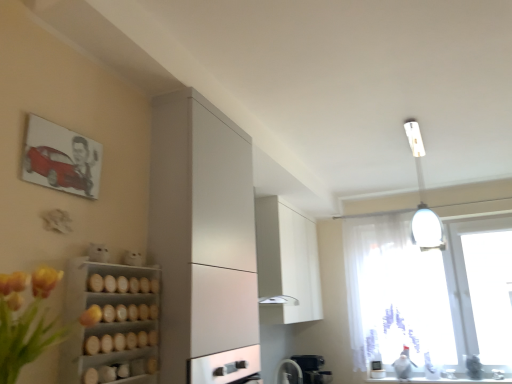
Question: Is white glossy fan at lower center not close to transparent fabric at right?

Choices:
 (A) no
 (B) yes

Answer: (B)

Question: Can you confirm if white glossy fan at lower center is bigger than transparent fabric at right?

Choices:
 (A) no
 (B) yes

Answer: (A)

Question: Can you confirm if white glossy fan at lower center is thinner than transparent fabric at right?

Choices:
 (A) yes
 (B) no

Answer: (B)

Question: Can you confirm if white glossy fan at lower center is taller than transparent fabric at right?

Choices:
 (A) no
 (B) yes

Answer: (A)

Question: Is white glossy fan at lower center in front of transparent fabric at right?

Choices:
 (A) no
 (B) yes

Answer: (B)

Question: In the image, is wooden shelves at lower left on the left side or the right side of white matte cabinet at upper center, positioned as the 2th cabinetry in front-to-back order?

Choices:
 (A) right
 (B) left

Answer: (B)

Question: Is point (62, 357) positioned closer to the camera than point (273, 301)?

Choices:
 (A) farther
 (B) closer

Answer: (B)

Question: Is wooden shelves at lower left taller or shorter than white matte cabinet at upper center, positioned as the 2th cabinetry in front-to-back order?

Choices:
 (A) short
 (B) tall

Answer: (A)

Question: Is wooden shelves at lower left in front of or behind white matte cabinet at upper center, which ranks as the first cabinetry in right-to-left order, in the image?

Choices:
 (A) front
 (B) behind

Answer: (A)

Question: Considering their positions, is white glossy light fixture at upper right located in front of or behind satin white cabinet at left, which is the second cabinetry in right-to-left order?

Choices:
 (A) front
 (B) behind

Answer: (B)

Question: In terms of height, does white glossy light fixture at upper right look taller or shorter compared to satin white cabinet at left, the first cabinetry viewed from the front?

Choices:
 (A) tall
 (B) short

Answer: (B)

Question: Looking at their shapes, would you say white glossy light fixture at upper right is wider or thinner than satin white cabinet at left, positioned as the 1th cabinetry in left-to-right order?

Choices:
 (A) thin
 (B) wide

Answer: (B)

Question: Is white glossy light fixture at upper right inside the boundaries of satin white cabinet at left, positioned as the 1th cabinetry in left-to-right order, or outside?

Choices:
 (A) outside
 (B) inside

Answer: (A)

Question: Does point (134, 365) appear closer or farther from the camera than point (280, 375)?

Choices:
 (A) farther
 (B) closer

Answer: (B)

Question: From the image's perspective, is wooden shelves at lower left positioned above or below white glossy fan at lower center?

Choices:
 (A) below
 (B) above

Answer: (B)